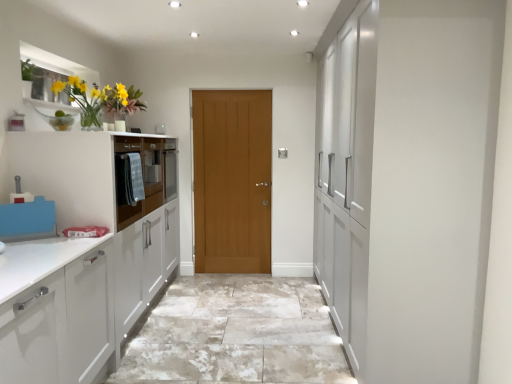
Locate an element on the screen. The width and height of the screenshot is (512, 384). matte gray oven at left is located at coordinates (145, 175).

Measure the distance between point (131, 145) and camera.

The depth of point (131, 145) is 9.74 feet.

The image size is (512, 384). I want to click on natural stone floor at center, so [x=236, y=334].

This screenshot has width=512, height=384. Find the location of `matte gray oven at left`. matte gray oven at left is located at coordinates (145, 175).

Between matte gray oven at left and light brown wooden door at center, which one is positioned in front?

matte gray oven at left.

From the image's perspective, is matte gray oven at left above or below light brown wooden door at center?

From the image's perspective, matte gray oven at left appears above light brown wooden door at center.

Identify the location of door beneath the matte gray oven at left (from a real-world perspective). (232, 180).

Considering the relative sizes of light brown wooden door at center and natural stone floor at center in the image provided, is light brown wooden door at center shorter than natural stone floor at center?

No, light brown wooden door at center is not shorter than natural stone floor at center.

Which is nearer, (264, 101) or (202, 329)?

The point (202, 329) is closer.

Is light brown wooden door at center directly adjacent to natural stone floor at center?

No, light brown wooden door at center is not with natural stone floor at center.

Based on the photo, considering their positions, is light brown wooden door at center located in front of or behind natural stone floor at center?

light brown wooden door at center is behind natural stone floor at center.

In the scene shown: From the image's perspective, relative to light brown wooden door at center, is natural stone floor at center above or below?

From the image's perspective, natural stone floor at center appears below light brown wooden door at center.

From a real-world perspective, is natural stone floor at center above or below light brown wooden door at center?

natural stone floor at center is situated lower than light brown wooden door at center in the real world.

Is natural stone floor at center far from light brown wooden door at center?

Yes, natural stone floor at center is far from light brown wooden door at center.

Is natural stone floor at center oriented towards light brown wooden door at center?

No.

Does light brown wooden door at center have a smaller size compared to matte gray oven at left?

Yes, light brown wooden door at center is smaller than matte gray oven at left.

Could you tell me if light brown wooden door at center is facing matte gray oven at left?

No.

From a real-world perspective, does light brown wooden door at center sit lower than matte gray oven at left?

Correct, in the physical world, light brown wooden door at center is lower than matte gray oven at left.

Based on their positions, is light brown wooden door at center located to the left or right of matte gray oven at left?

Based on their positions, light brown wooden door at center is located to the right of matte gray oven at left.

Is natural stone floor at center next to matte gray oven at left?

No.

The image size is (512, 384). Find the location of `granite on the right of matte gray oven at left`. granite on the right of matte gray oven at left is located at coordinates (236, 334).

Which of these two, natural stone floor at center or matte gray oven at left, is bigger?

natural stone floor at center.

From the picture: From the image's perspective, relative to natural stone floor at center, is matte glass vase at upper left above or below?

From the image's perspective, matte glass vase at upper left appears above natural stone floor at center.

Locate an element on the screen. granite that appears below the matte glass vase at upper left (from a real-world perspective) is located at coordinates [236, 334].

Consider the image. Considering the sizes of objects matte glass vase at upper left and natural stone floor at center in the image provided, who is taller, matte glass vase at upper left or natural stone floor at center?

Standing taller between the two is matte glass vase at upper left.

In the scene shown: Is matte glass vase at upper left far away from light brown wooden door at center?

matte glass vase at upper left is positioned a significant distance from light brown wooden door at center.

In the image, is matte glass vase at upper left positioned in front of or behind light brown wooden door at center?

Clearly, matte glass vase at upper left is in front of light brown wooden door at center.

From the image's perspective, would you say matte glass vase at upper left is positioned over light brown wooden door at center?

Yes, from the image's perspective, matte glass vase at upper left is over light brown wooden door at center.

At what (x,y) coordinates should I click in order to perform the action: click on floral arrangement above the light brown wooden door at center (from the image's perspective). Please return your answer as a coordinate pair (x, y). The image size is (512, 384). Looking at the image, I should click on (100, 99).

At what (x,y) coordinates should I click in order to perform the action: click on oven on the left of light brown wooden door at center. Please return your answer as a coordinate pair (x, y). Looking at the image, I should click on (145, 175).

Where is `granite that is under the light brown wooden door at center (from a real-world perspective)`? The width and height of the screenshot is (512, 384). granite that is under the light brown wooden door at center (from a real-world perspective) is located at coordinates [236, 334].

Considering their positions, is matte gray oven at left positioned closer to matte glass vase at upper left than light brown wooden door at center?

Among the two, matte gray oven at left is located nearer to matte glass vase at upper left.

Based on their spatial positions, is matte gray oven at left or matte glass vase at upper left closer to light brown wooden door at center?

matte gray oven at left is closer to light brown wooden door at center.

When comparing their distances from light brown wooden door at center, does natural stone floor at center or matte glass vase at upper left seem closer?

natural stone floor at center is closer to light brown wooden door at center.

Which object lies further to the anchor point natural stone floor at center, matte gray oven at left or matte glass vase at upper left?

Among the two, matte glass vase at upper left is located further to natural stone floor at center.

Looking at the image, which one is located further to matte glass vase at upper left, light brown wooden door at center or natural stone floor at center?

Among the two, natural stone floor at center is located further to matte glass vase at upper left.

Looking at this image, looking at the image, which one is located closer to matte glass vase at upper left, natural stone floor at center or light brown wooden door at center?

Among the two, light brown wooden door at center is located nearer to matte glass vase at upper left.

Which object lies further to the anchor point matte gray oven at left, natural stone floor at center or light brown wooden door at center?

natural stone floor at center is further to matte gray oven at left.

Estimate the real-world distances between objects in this image. Which object is closer to natural stone floor at center, light brown wooden door at center or matte glass vase at upper left?

light brown wooden door at center is closer to natural stone floor at center.

Locate an element on the screen. oven positioned between natural stone floor at center and light brown wooden door at center from near to far is located at coordinates 145,175.

At what (x,y) coordinates should I click in order to perform the action: click on oven between matte glass vase at upper left and light brown wooden door at center along the z-axis. Please return your answer as a coordinate pair (x, y). This screenshot has width=512, height=384. Looking at the image, I should click on (145, 175).

Locate an element on the screen. granite positioned between matte glass vase at upper left and light brown wooden door at center from near to far is located at coordinates (236, 334).

Where is `oven between matte glass vase at upper left and natural stone floor at center in the up-down direction`? The image size is (512, 384). oven between matte glass vase at upper left and natural stone floor at center in the up-down direction is located at coordinates (145, 175).